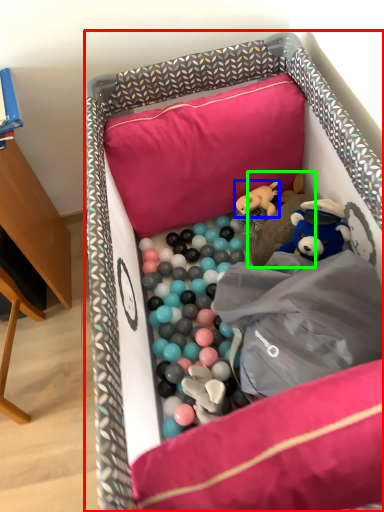
Question: Which is farther away from infant bed (highlighted by a red box)? toy (highlighted by a blue box) or toy (highlighted by a green box)?

Choices:
 (A) toy
 (B) toy

Answer: (A)